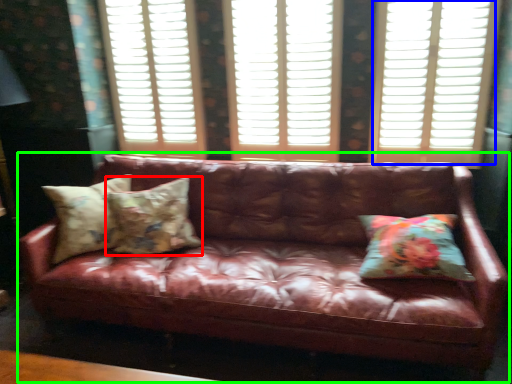
Question: Which is farther away from pillow (highlighted by a red box)? window (highlighted by a blue box) or studio couch (highlighted by a green box)?

Choices:
 (A) window
 (B) studio couch

Answer: (A)